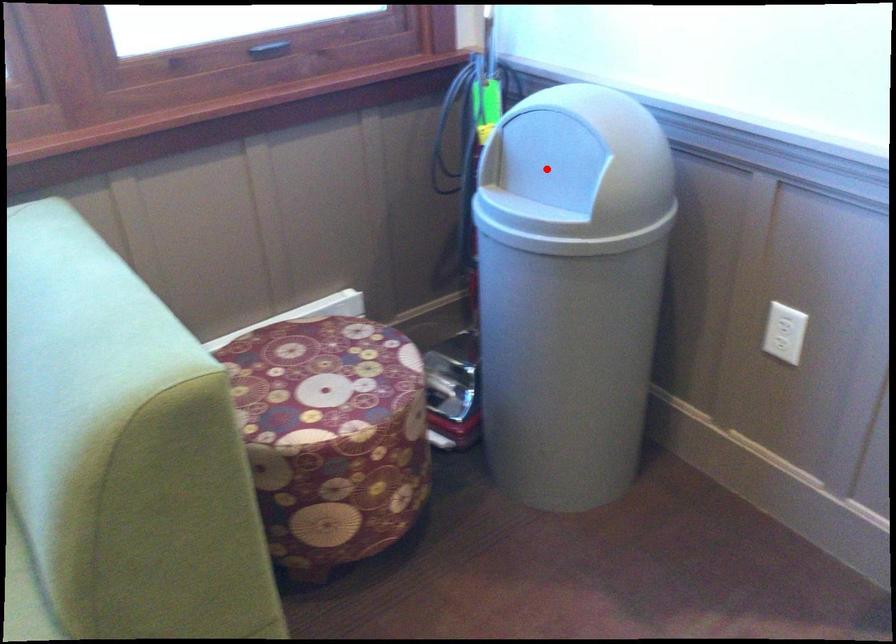
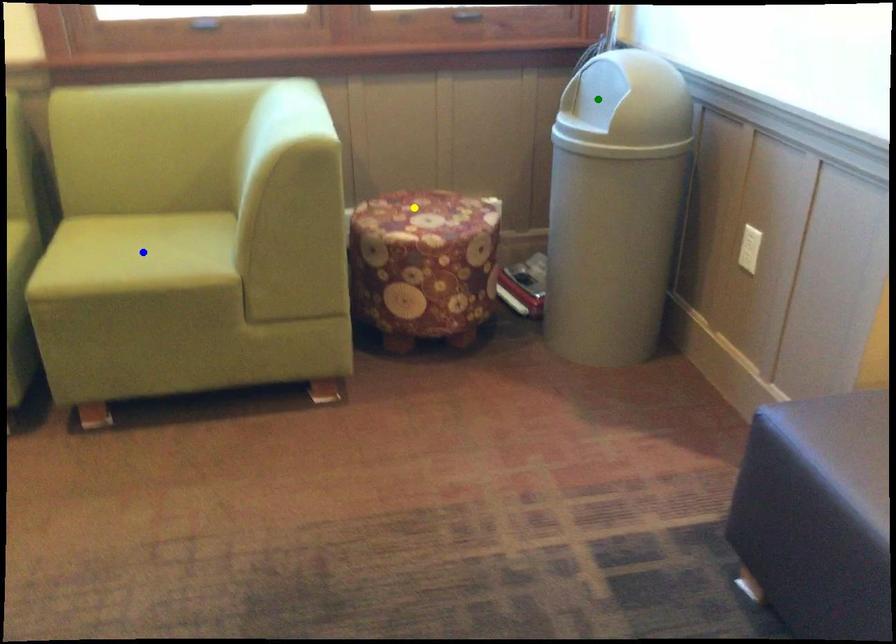
Question: I am providing you with two images of the same scene from different viewpoints. A red point is marked on the first image. You are given multiple points on the second image. Which mark in image 2 goes with the point in image 1?

Choices:
 (A) yellow point
 (B) green point
 (C) blue point

Answer: (B)